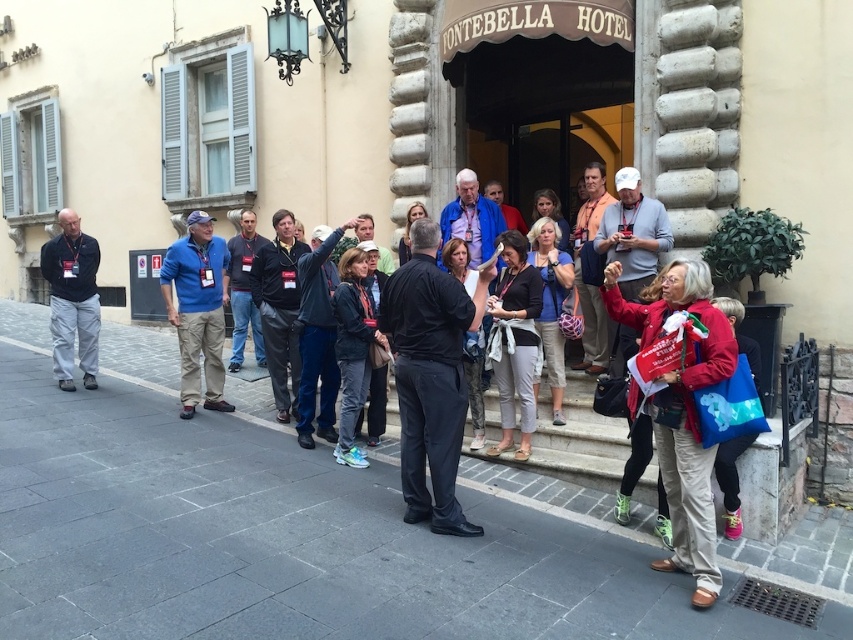
Looking at this image, can you confirm if gray stone pavement at center is positioned below dark gray jacket at left?

Indeed, gray stone pavement at center is positioned under dark gray jacket at left.

Between point (0, 592) and point (57, 234), which one is positioned in front?

Positioned in front is point (0, 592).

Find the location of a particular element. The width and height of the screenshot is (853, 640). gray stone pavement at center is located at coordinates (317, 529).

This screenshot has height=640, width=853. Identify the location of dark gray jacket at left. (73, 300).

Describe the element at coordinates (73, 300) in the screenshot. The image size is (853, 640). I see `dark gray jacket at left` at that location.

Is point (80, 353) closer to camera compared to point (502, 385)?

No, it is behind (502, 385).

What are the coordinates of `dark gray jacket at left` in the screenshot? It's located at (73, 300).

Can you confirm if red fabric bag at lower right is wider than dark gray jacket at left?

Yes.

Which is in front, point (699, 387) or point (68, 298)?

Point (699, 387) is more forward.

At what (x,y) coordinates should I click in order to perform the action: click on red fabric bag at lower right. Please return your answer as a coordinate pair (x, y). Looking at the image, I should click on (682, 410).

At what (x,y) coordinates should I click in order to perform the action: click on red fabric bag at lower right. Please return your answer as a coordinate pair (x, y). This screenshot has height=640, width=853. Looking at the image, I should click on (682, 410).